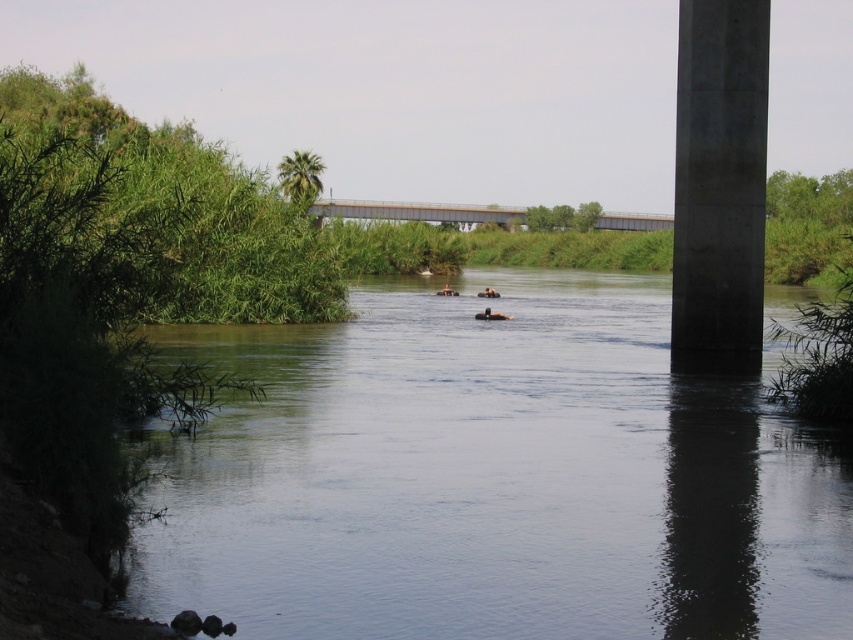
You are planning to cross the river using a small boat that can only handle a maximum width of 5 meters. Based on the scene, can you safely navigate the clear water at center to reach the concrete at right?

The clear water at center has a larger width than the concrete at right. Since the boat can only handle up to 5 meters, and the water is wider, it might exceed the boat capacity. However, the concrete at right is narrower. To be safe, you should check the exact width of the clear water at center before deciding.

You are standing at the edge of the river and want to take a photo of both point (497, 212) and point (444, 292) in the scene. Which point should you focus on first to ensure both are in clear view?

You should focus on point (497, 212) first because it is closer to the camera than point (444, 292), ensuring both points are in focus when using a shallow depth of field.